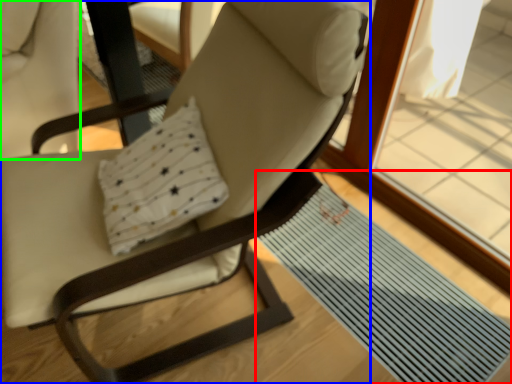
Question: Based on their relative distances, which object is farther from mat (highlighted by a red box)? Choose from chair (highlighted by a blue box) and swivel chair (highlighted by a green box).

Choices:
 (A) chair
 (B) swivel chair

Answer: (B)